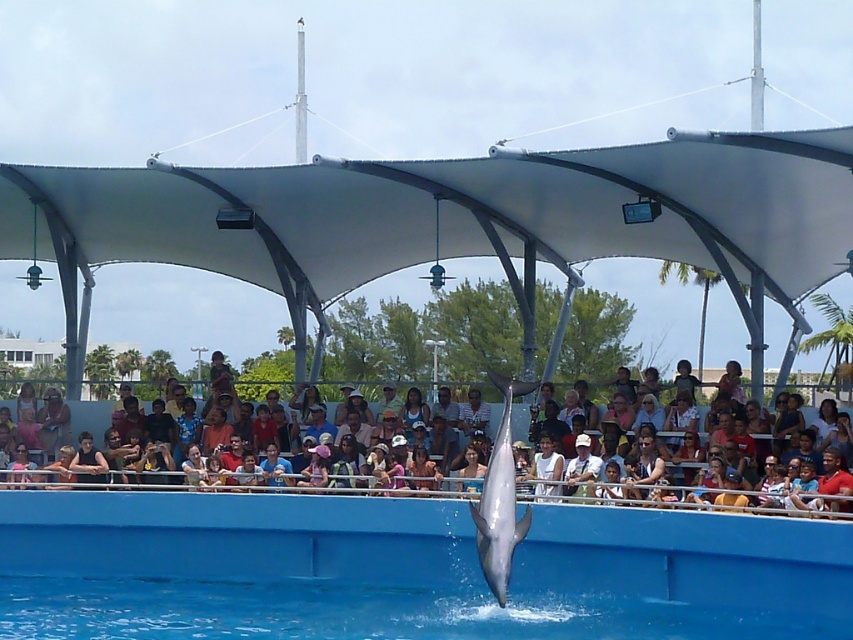
Is point (337, 496) more distant than point (494, 589)?

Yes.

The image size is (853, 640). I want to click on multicolored fabric crowd at center, so click(257, 481).

Describe the element at coordinates (257, 481) in the screenshot. I see `multicolored fabric crowd at center` at that location.

Image resolution: width=853 pixels, height=640 pixels. I want to click on multicolored fabric crowd at center, so pyautogui.click(x=257, y=481).

Which is more to the left, blue smooth water at center or white cap at center?

blue smooth water at center

Find the location of a particular element. blue smooth water at center is located at coordinates (405, 570).

Locate an element on the screen. Image resolution: width=853 pixels, height=640 pixels. blue smooth water at center is located at coordinates (405, 570).

Is blue smooth water at center below multicolored fabric crowd at center?

Indeed, blue smooth water at center is positioned under multicolored fabric crowd at center.

Does point (39, 493) lie in front of point (286, 492)?

No, (39, 493) is behind (286, 492).

Between point (320, 632) and point (107, 468), which one is positioned behind?

Positioned behind is point (107, 468).

Locate an element on the screen. The width and height of the screenshot is (853, 640). blue smooth water at center is located at coordinates (405, 570).